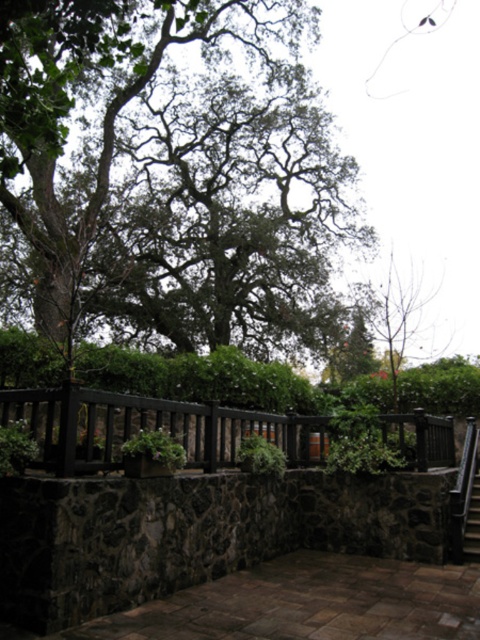
Which is above, black wood fence at center or metallic staircase at center?

black wood fence at center

Locate an element on the screen. The height and width of the screenshot is (640, 480). black wood fence at center is located at coordinates (151, 428).

The height and width of the screenshot is (640, 480). What are the coordinates of `black wood fence at center` in the screenshot? It's located at (151, 428).

Does green leafy tree at upper center appear on the left side of metallic staircase at center?

Correct, you'll find green leafy tree at upper center to the left of metallic staircase at center.

This screenshot has height=640, width=480. What do you see at coordinates (166, 172) in the screenshot?
I see `green leafy tree at upper center` at bounding box center [166, 172].

This screenshot has width=480, height=640. I want to click on green leafy tree at upper center, so click(166, 172).

Between green leafy tree at upper center and black wood fence at center, which one has less height?

black wood fence at center

Is point (162, 54) farther from camera compared to point (312, 420)?

Yes, point (162, 54) is behind point (312, 420).

Describe the element at coordinates (166, 172) in the screenshot. I see `green leafy tree at upper center` at that location.

Identify the location of green leafy tree at upper center. The height and width of the screenshot is (640, 480). (166, 172).